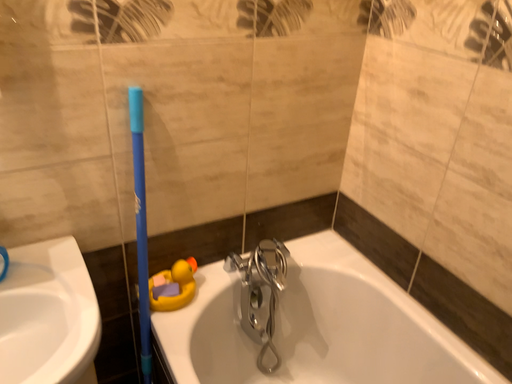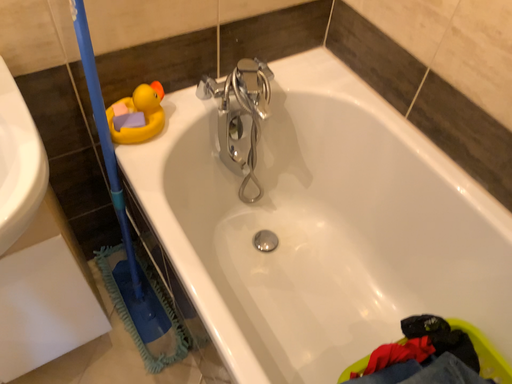
Question: Which way did the camera rotate in the video?

Choices:
 (A) rotated downward
 (B) rotated upward

Answer: (A)